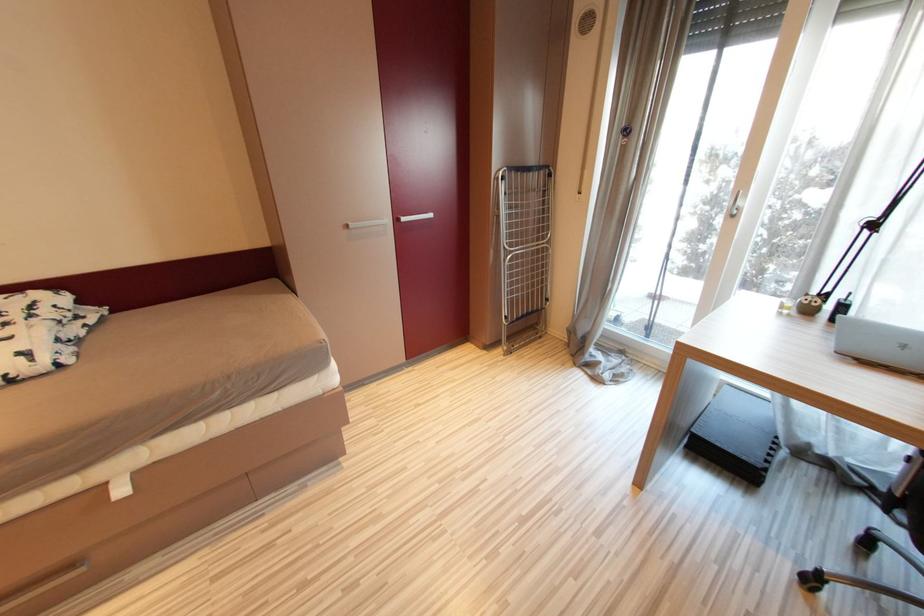
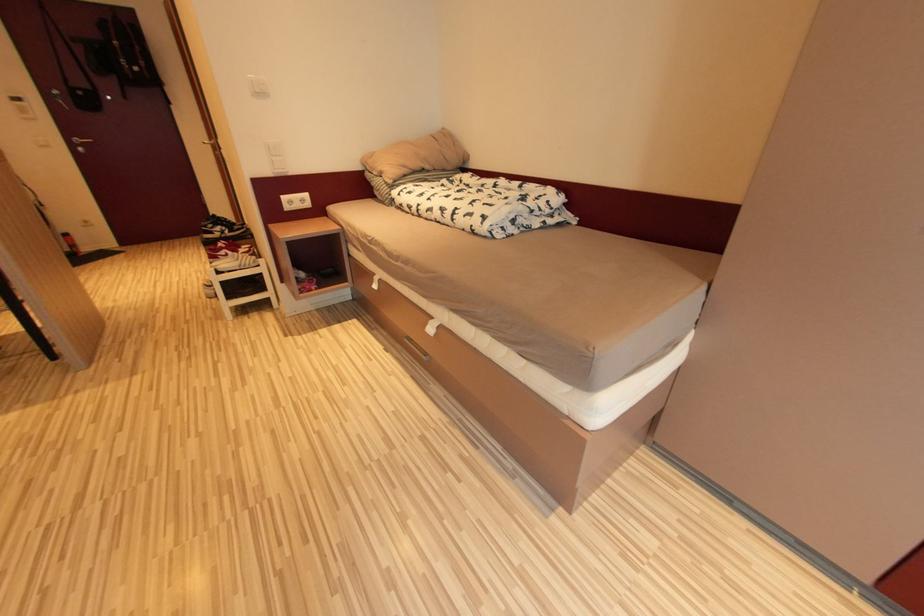
Based on the continuous images, in which direction is the camera rotating?

Answer: The camera's rotation is toward left-down.